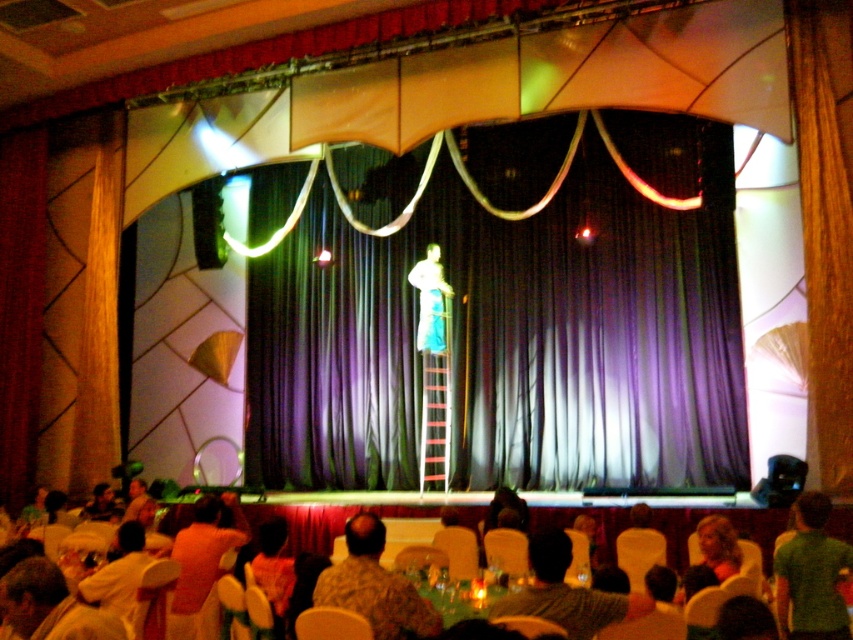
Question: Which of these objects is positioned closest to the camouflage shirt at lower center?

Choices:
 (A) light blue fabric at center
 (B) green fabric shirt at lower right
 (C) orange fabric shirt at lower left
 (D) purple fabric curtain at center

Answer: (C)

Question: Observing the image, what is the correct spatial positioning of green fabric shirt at lower right in reference to green fabric shirt at lower center?

Choices:
 (A) right
 (B) left

Answer: (A)

Question: Considering the real-world distances, which object is closest to the green fabric shirt at lower right?

Choices:
 (A) light blue fabric at center
 (B) green fabric shirt at lower center
 (C) purple fabric curtain at center
 (D) camouflage shirt at lower center

Answer: (B)

Question: Considering the relative positions of camouflage shirt at lower center and orange fabric shirt at lower left in the image provided, where is camouflage shirt at lower center located with respect to orange fabric shirt at lower left?

Choices:
 (A) left
 (B) right

Answer: (B)

Question: Which point appears closest to the camera in this image?

Choices:
 (A) (416, 324)
 (B) (410, 605)

Answer: (B)

Question: Can you confirm if green fabric shirt at lower center is thinner than orange fabric shirt at lower left?

Choices:
 (A) no
 (B) yes

Answer: (A)